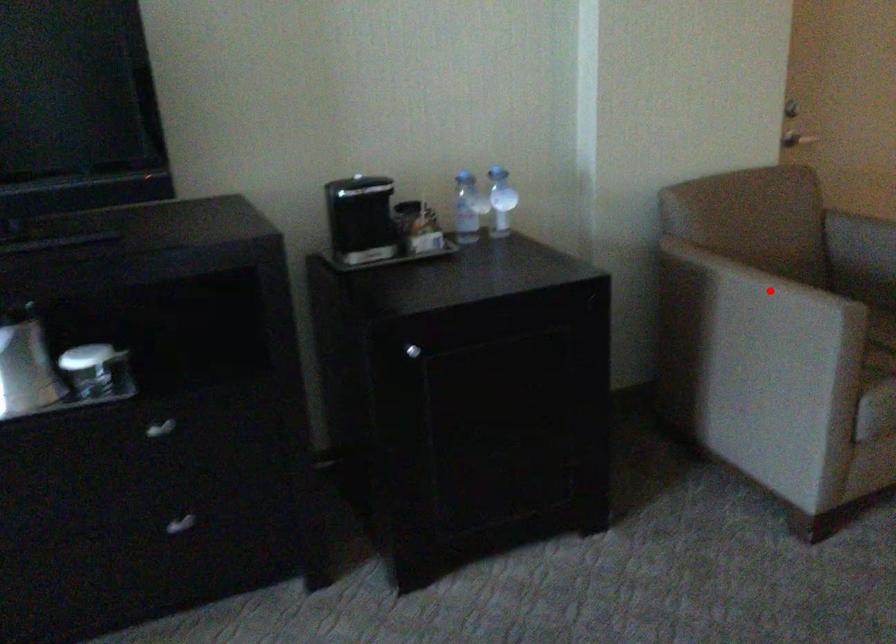
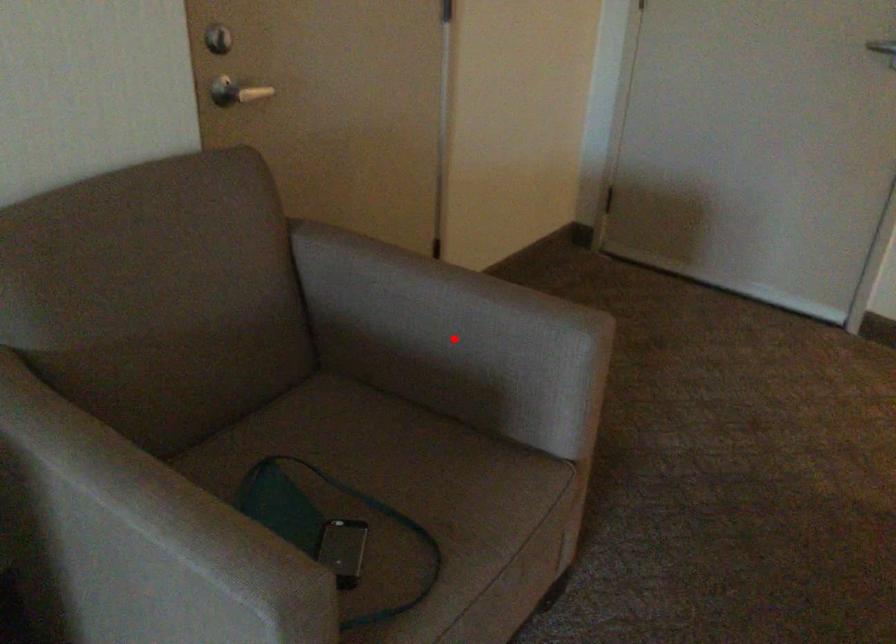
Consider the image. I am providing you with two images of the same scene from different viewpoints. A red point is marked on the first image and another point is marked on the second image. Is the marked point in image1 the same physical position as the marked point in image2?

No